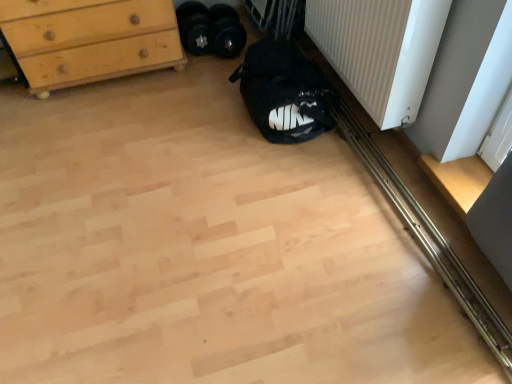
Find the location of a particular element. This screenshot has width=512, height=384. free space to the left of black fabric sleeping bag at lower center is located at coordinates (185, 114).